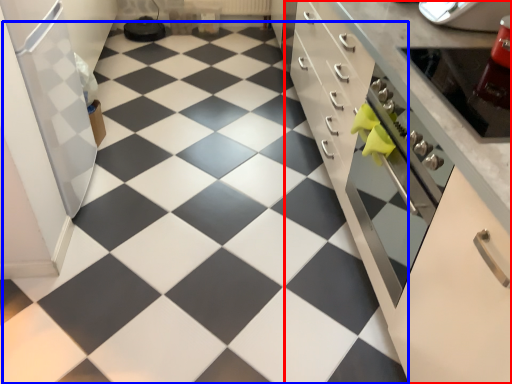
Question: Among these objects, which one is farthest to the camera, cabinetry (highlighted by a red box) or tile (highlighted by a blue box)?

Choices:
 (A) cabinetry
 (B) tile

Answer: (B)